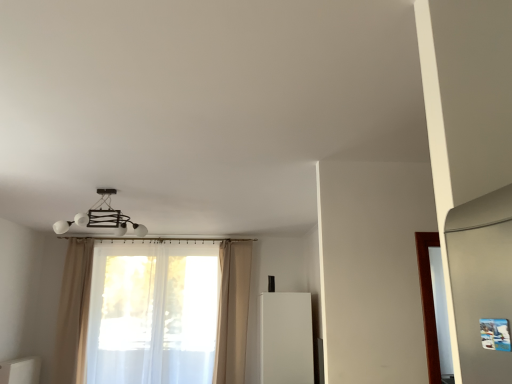
Question: In the image, is beige fabric curtain at center, acting as the third curtain starting from the left, on the left side or the right side of white matte refrigerator at center?

Choices:
 (A) left
 (B) right

Answer: (A)

Question: Considering the positions of beige fabric curtain at center, which is the first curtain from right to left, and white matte refrigerator at center in the image, is beige fabric curtain at center, which is the first curtain from right to left, bigger or smaller than white matte refrigerator at center?

Choices:
 (A) big
 (B) small

Answer: (B)

Question: Which object is the farthest from the beige fabric curtain at center, acting as the third curtain starting from the left?

Choices:
 (A) translucent white curtain at center, acting as the second curtain starting from the left
 (B) white matte refrigerator at center
 (C) white glossy cabinet at lower left
 (D) matte white chandelier at upper center
 (E) beige fabric curtain at left, the 1th curtain in the left-to-right sequence

Answer: (C)

Question: Which of these objects is positioned farthest from the beige fabric curtain at left, the 1th curtain in the left-to-right sequence?

Choices:
 (A) white matte refrigerator at center
 (B) translucent white curtain at center, acting as the second curtain starting from the left
 (C) beige fabric curtain at center, acting as the third curtain starting from the left
 (D) matte white chandelier at upper center
 (E) white glossy cabinet at lower left

Answer: (A)